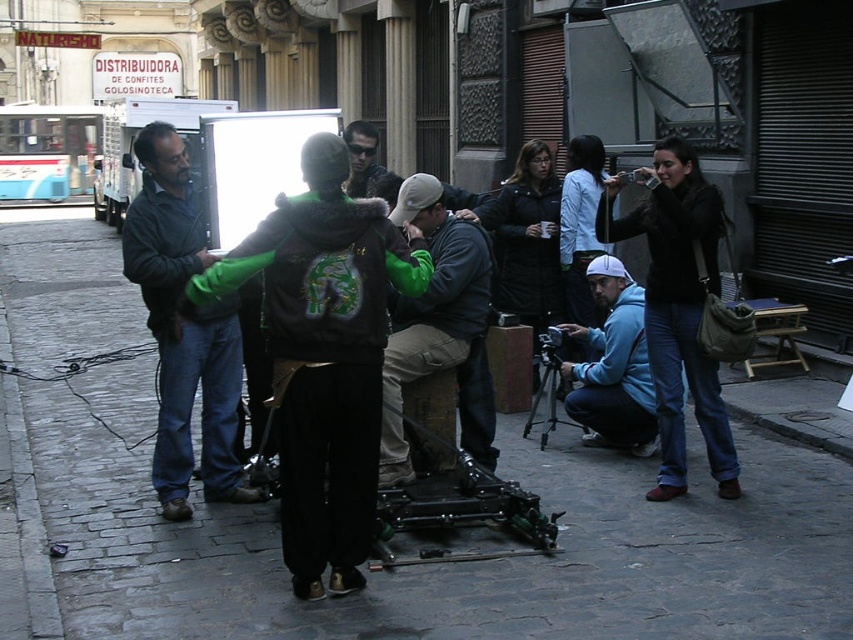
Can you confirm if dark gray cobblestone at center is positioned to the left of green fuzzy jacket at center?

Correct, you'll find dark gray cobblestone at center to the left of green fuzzy jacket at center.

Which of these two, dark gray cobblestone at center or green fuzzy jacket at center, stands taller?

green fuzzy jacket at center is taller.

Where is `dark gray cobblestone at center`? This screenshot has width=853, height=640. dark gray cobblestone at center is located at coordinates (457, 563).

Find the location of `dark gray cobblestone at center`. dark gray cobblestone at center is located at coordinates (457, 563).

Does green fuzzy jacket at center appear over black matte tripod at center?

Yes.

Who is taller, green fuzzy jacket at center or black matte tripod at center?

With more height is green fuzzy jacket at center.

This screenshot has height=640, width=853. What do you see at coordinates (323, 355) in the screenshot?
I see `green fuzzy jacket at center` at bounding box center [323, 355].

Find the location of a particular element. The width and height of the screenshot is (853, 640). green fuzzy jacket at center is located at coordinates (323, 355).

Is point (778, 632) in front of point (357, 164)?

That is True.

The image size is (853, 640). What do you see at coordinates (457, 563) in the screenshot? I see `dark gray cobblestone at center` at bounding box center [457, 563].

Based on the photo, measure the distance between point (704, 525) and camera.

Point (704, 525) and camera are 4.71 meters apart from each other.

The height and width of the screenshot is (640, 853). Find the location of `dark gray cobblestone at center`. dark gray cobblestone at center is located at coordinates (457, 563).